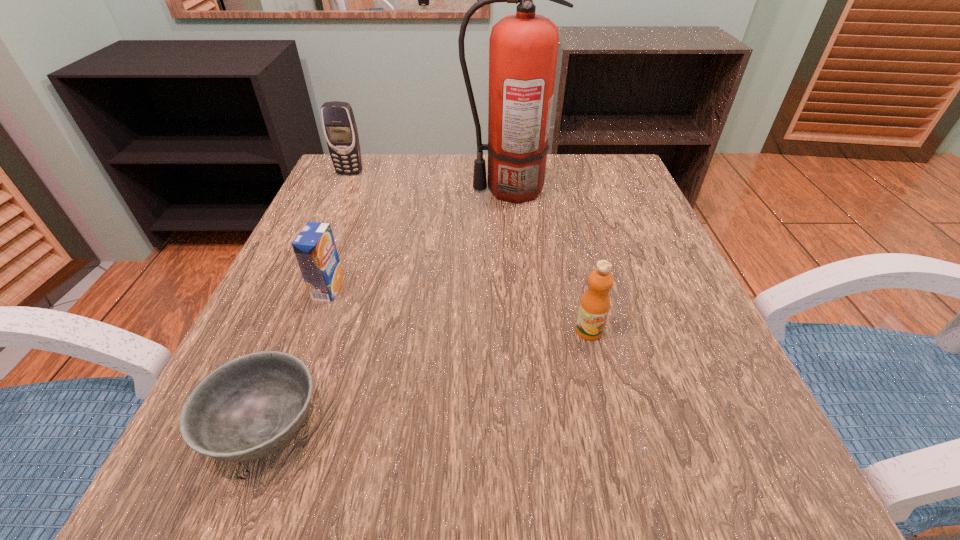
Identify the location of fire extinguisher. [x=523, y=47].

I want to click on the fourth shortest object, so click(x=340, y=129).

This screenshot has height=540, width=960. I want to click on the fourth farthest object, so click(594, 307).

Find the location of `the right orange_juice`. the right orange_juice is located at coordinates (594, 307).

Image resolution: width=960 pixels, height=540 pixels. I want to click on the left orange_juice, so 314,247.

Identify the location of the third nearest object. This screenshot has height=540, width=960. (314, 247).

Where is `the nearest object`? The height and width of the screenshot is (540, 960). the nearest object is located at coordinates (249, 407).

Locate an element on the screen. the shortest object is located at coordinates (249, 407).

In order to click on blank area located on the nozzle of the tallest object in this screenshot , I will do `click(360, 190)`.

You are a GUI agent. You are given a task and a screenshot of the screen. Output one action in this format:
    pyautogui.click(x=<x>, y=<y>)
    Task: Click on the free region located 0.280m on the nozzle of the tallest object
    The height and width of the screenshot is (540, 960).
    Given the screenshot: What is the action you would take?
    pyautogui.click(x=343, y=190)